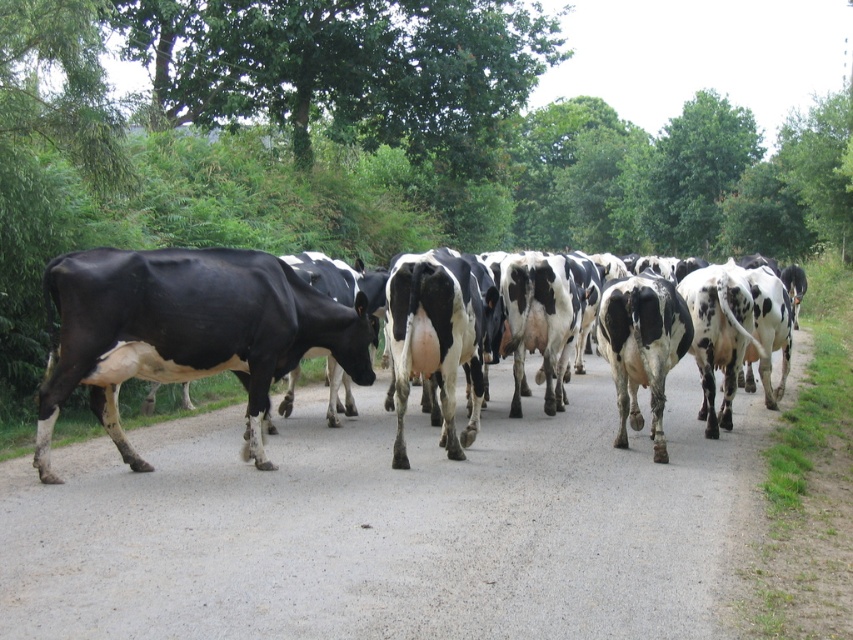
Question: Does black glossy cow at left have a greater width compared to black glossy cow at center?

Choices:
 (A) no
 (B) yes

Answer: (A)

Question: Is black glossy cow at left further to the viewer compared to black glossy cow at center?

Choices:
 (A) no
 (B) yes

Answer: (B)

Question: Which object appears closest to the camera in this image?

Choices:
 (A) black glossy cow at left
 (B) black glossy cow at center

Answer: (B)

Question: Which point appears closest to the camera in this image?

Choices:
 (A) (287, 340)
 (B) (247, 259)

Answer: (B)

Question: Does black glossy cow at left have a lesser width compared to black glossy cow at center?

Choices:
 (A) yes
 (B) no

Answer: (A)